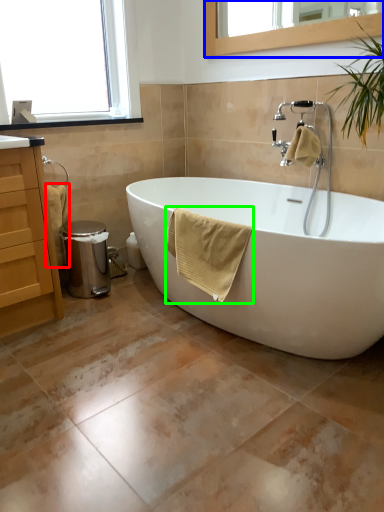
Question: Which object is positioned closest to material (highlighted by a red box)? Select from mirror (highlighted by a blue box) and bath towel (highlighted by a green box).

Choices:
 (A) mirror
 (B) bath towel

Answer: (B)